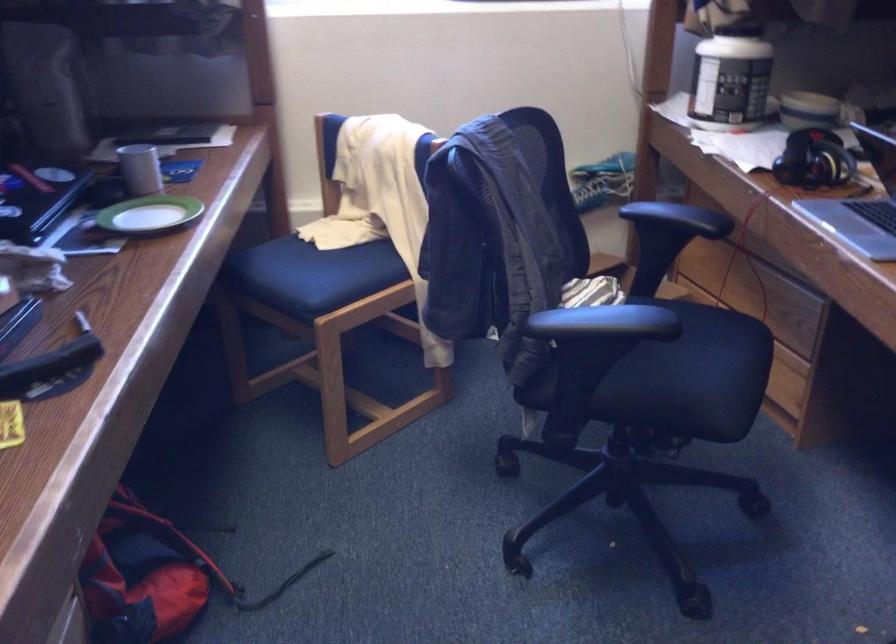
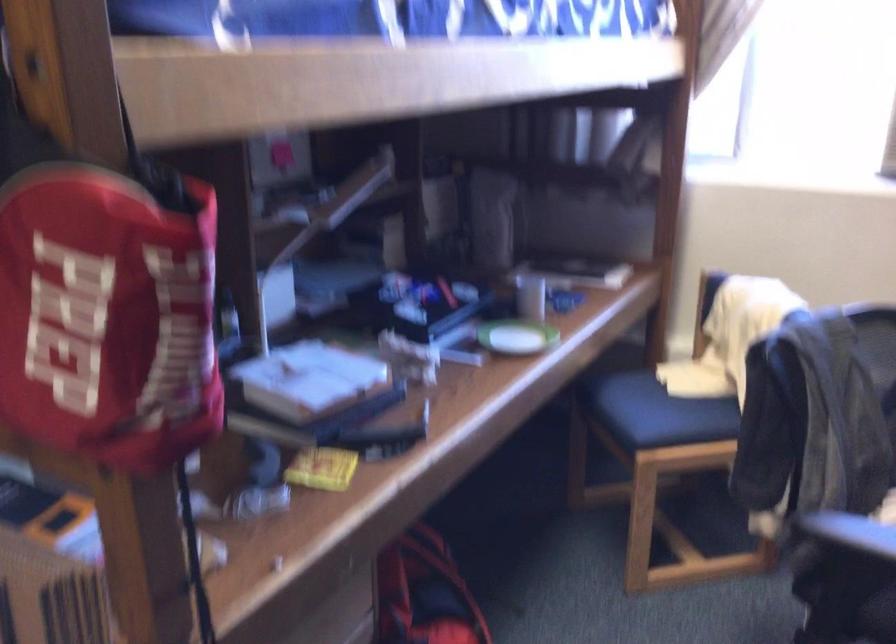
In the second image, find the point that corresponds to point (332, 272) in the first image.

(668, 415)